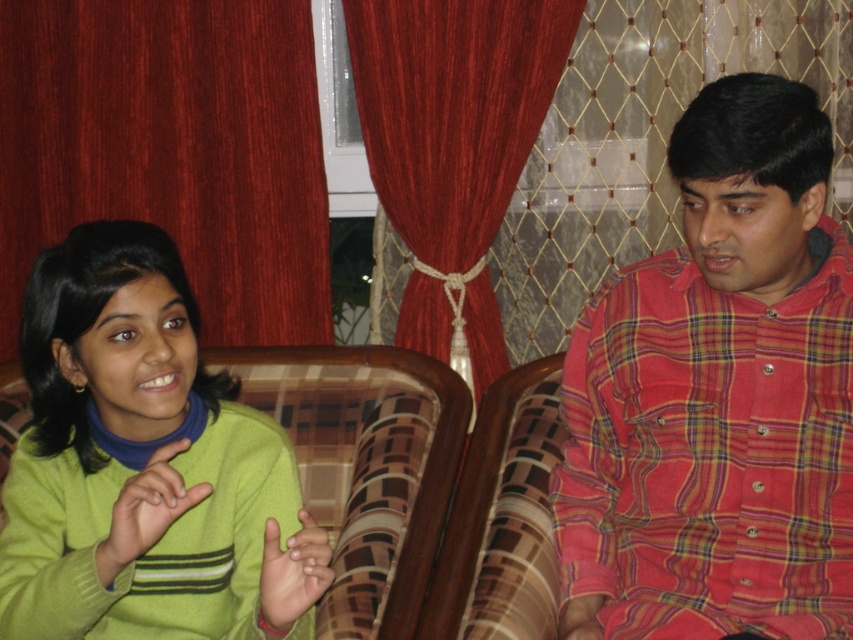
Question: Is red plaid shirt at right wider than green knitted sweater at left?

Choices:
 (A) yes
 (B) no

Answer: (B)

Question: Which point appears closest to the camera in this image?

Choices:
 (A) (233, 138)
 (B) (155, 518)
 (C) (732, 531)

Answer: (B)

Question: Which point is farther to the camera?

Choices:
 (A) green matte hand at lower left
 (B) red plaid shirt at right
 (C) green knitted sweater at left
 (D) smooth skin hand at center

Answer: (B)

Question: Can you confirm if green knitted sweater at left is positioned to the right of smooth skin hand at center?

Choices:
 (A) no
 (B) yes

Answer: (A)

Question: Which of these objects is positioned farthest from the velvet-like red curtain at center?

Choices:
 (A) smooth skin hand at center
 (B) green knitted sweater at left
 (C) green matte hand at lower left
 (D) red plaid shirt at right

Answer: (A)

Question: From the image, what is the correct spatial relationship of red plaid shirt at right in relation to maroon fabric curtain at upper left?

Choices:
 (A) right
 (B) left

Answer: (A)